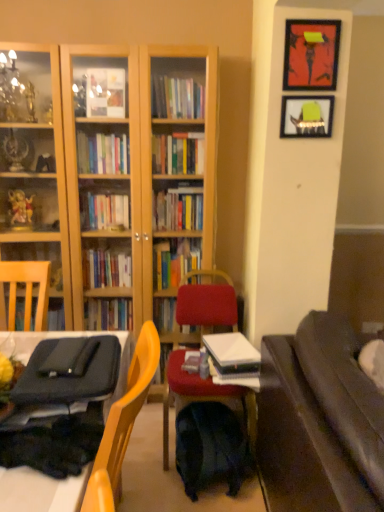
Question: From the image's perspective, is metallic framed artwork at upper right, arranged as the first picture frame when viewed from the top, located beneath matte green picture frame at upper right, arranged as the second picture frame when viewed from the top?

Choices:
 (A) no
 (B) yes

Answer: (A)

Question: Is metallic framed artwork at upper right, arranged as the first picture frame when viewed from the top, surrounding matte green picture frame at upper right, arranged as the second picture frame when viewed from the top?

Choices:
 (A) no
 (B) yes

Answer: (A)

Question: Would you consider metallic framed artwork at upper right, arranged as the first picture frame when viewed from the top, to be distant from matte green picture frame at upper right, arranged as the second picture frame when viewed from the top?

Choices:
 (A) no
 (B) yes

Answer: (A)

Question: Does metallic framed artwork at upper right, marked as the second picture frame in a bottom-to-top arrangement, appear on the left side of matte green picture frame at upper right, which is the first picture frame from bottom to top?

Choices:
 (A) yes
 (B) no

Answer: (B)

Question: Considering the relative sizes of metallic framed artwork at upper right, marked as the second picture frame in a bottom-to-top arrangement, and matte green picture frame at upper right, which is the first picture frame from bottom to top, in the image provided, is metallic framed artwork at upper right, marked as the second picture frame in a bottom-to-top arrangement, bigger than matte green picture frame at upper right, which is the first picture frame from bottom to top,?

Choices:
 (A) yes
 (B) no

Answer: (A)

Question: Considering their positions, is metallic framed artwork at upper right, arranged as the first picture frame when viewed from the top, located in front of or behind velvet red chair at center?

Choices:
 (A) front
 (B) behind

Answer: (A)

Question: Is point (322, 59) positioned closer to the camera than point (192, 270)?

Choices:
 (A) closer
 (B) farther

Answer: (A)

Question: From a real-world perspective, is metallic framed artwork at upper right, arranged as the first picture frame when viewed from the top, positioned above or below velvet red chair at center?

Choices:
 (A) above
 (B) below

Answer: (A)

Question: From the image's perspective, relative to velvet red chair at center, is metallic framed artwork at upper right, marked as the second picture frame in a bottom-to-top arrangement, above or below?

Choices:
 (A) above
 (B) below

Answer: (A)

Question: Is point coord(218,387) closer or farther from the camera than point coord(289,100)?

Choices:
 (A) closer
 (B) farther

Answer: (A)

Question: Considering the positions of velvet red chair at center and matte green picture frame at upper right, which is the first picture frame from bottom to top, in the image, is velvet red chair at center taller or shorter than matte green picture frame at upper right, which is the first picture frame from bottom to top,?

Choices:
 (A) tall
 (B) short

Answer: (A)

Question: In terms of width, does velvet red chair at center look wider or thinner when compared to matte green picture frame at upper right, arranged as the second picture frame when viewed from the top?

Choices:
 (A) wide
 (B) thin

Answer: (A)

Question: From the image's perspective, is velvet red chair at center located above or below matte green picture frame at upper right, which is the first picture frame from bottom to top?

Choices:
 (A) below
 (B) above

Answer: (A)

Question: Is metallic framed artwork at upper right, marked as the second picture frame in a bottom-to-top arrangement, bigger or smaller than matte green picture frame at upper right, arranged as the second picture frame when viewed from the top?

Choices:
 (A) small
 (B) big

Answer: (B)

Question: Is point (296, 35) closer or farther from the camera than point (309, 125)?

Choices:
 (A) farther
 (B) closer

Answer: (B)